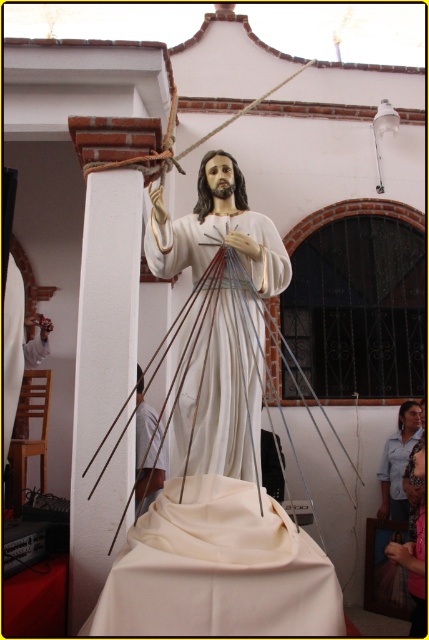
This screenshot has height=640, width=429. What are the coordinates of `white glossy statue at center` in the screenshot? It's located at (220, 317).

Between white glossy statue at center and white fabric at lower center, which one has more height?

white glossy statue at center

Which is in front, point (256, 285) or point (145, 408)?

Positioned in front is point (256, 285).

Where is `white glossy statue at center`? The height and width of the screenshot is (640, 429). white glossy statue at center is located at coordinates (220, 317).